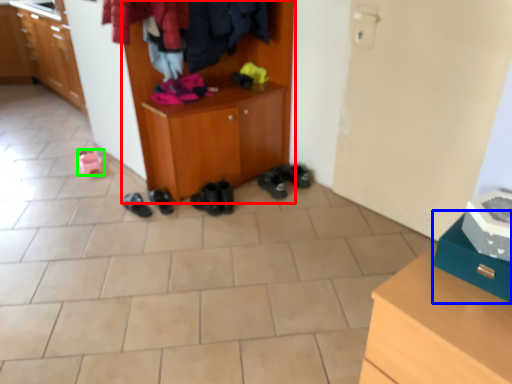
Question: Which is nearer to the cabinetry (highlighted by a red box)? shoe (highlighted by a blue box) or footwear (highlighted by a green box).

Choices:
 (A) shoe
 (B) footwear

Answer: (B)